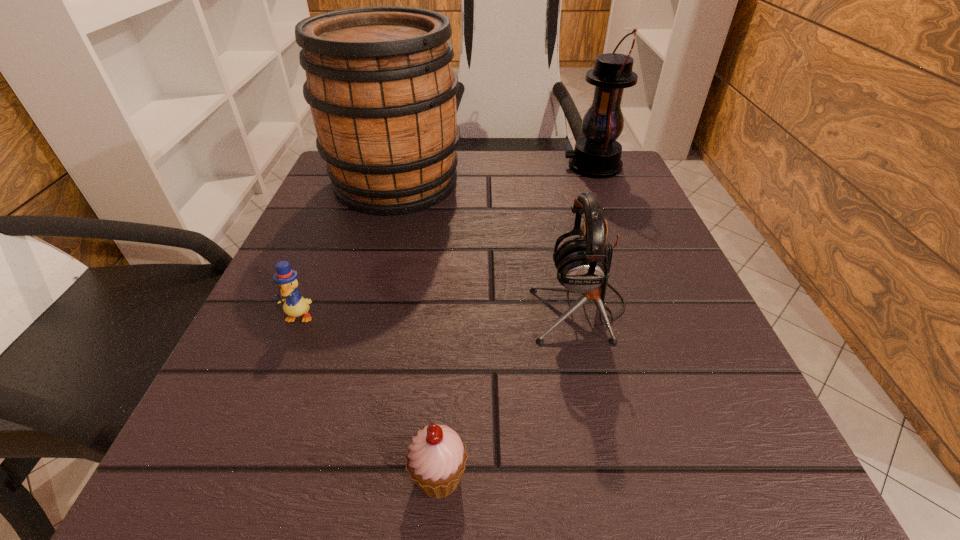
Where is `object that is at the far right corner`? This screenshot has height=540, width=960. object that is at the far right corner is located at coordinates (597, 155).

Identify the location of free space at the far edge of the desktop. This screenshot has width=960, height=540. (532, 151).

In the image, there is a desktop. Identify the location of vacant space at the near edge. point(327,459).

In the image, there is a desktop. At what (x,y) coordinates should I click in order to perform the action: click on free space at the left edge. Please return your answer as a coordinate pair (x, y). This screenshot has width=960, height=540. Looking at the image, I should click on (341, 348).

The width and height of the screenshot is (960, 540). I want to click on vacant point at the right edge, so click(x=649, y=398).

At what (x,y) coordinates should I click in order to perform the action: click on blank space at the near left corner of the desktop. Please return your answer as a coordinate pair (x, y). Looking at the image, I should click on (202, 451).

Where is `vacant point at the far right corner`? vacant point at the far right corner is located at coordinates (632, 194).

The width and height of the screenshot is (960, 540). In order to click on blank region between the duckling and the nearest object in this screenshot , I will do `click(369, 396)`.

This screenshot has height=540, width=960. In order to click on vacant space in between the cider and the lantern in this screenshot , I will do `click(494, 174)`.

I want to click on vacant area that lies between the cider and the duckling, so click(x=348, y=249).